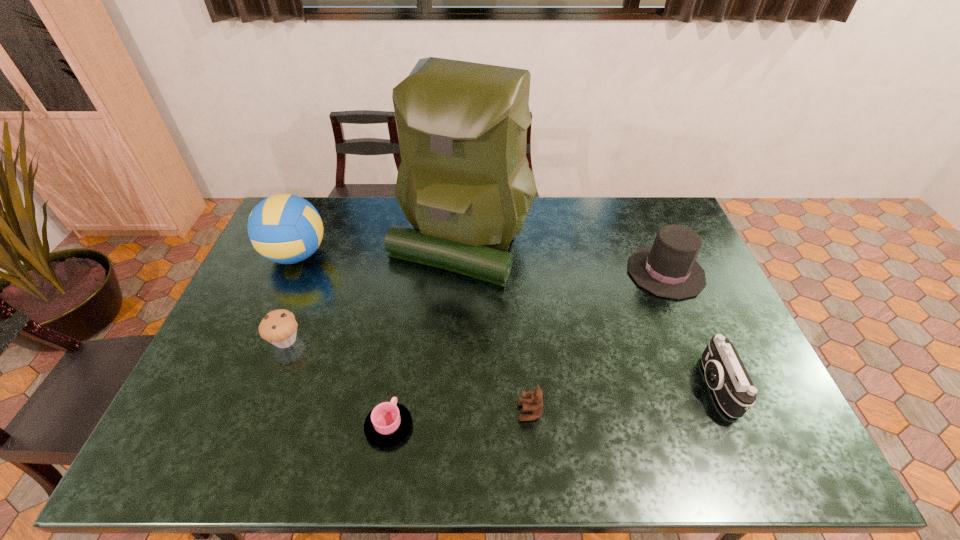
Where is `free space located 0.330m on the front of the fifth shortest object with the decoration`? Image resolution: width=960 pixels, height=540 pixels. free space located 0.330m on the front of the fifth shortest object with the decoration is located at coordinates (525, 272).

You are a GUI agent. You are given a task and a screenshot of the screen. Output one action in this format:
    pyautogui.click(x=<x>, y=<y>)
    Task: Click on the free space located on the front of the fifth shortest object with the decoration
    This screenshot has height=540, width=960.
    Given the screenshot: What is the action you would take?
    pyautogui.click(x=612, y=272)

Locate an element on the screen. free space located on the front lens of the camera is located at coordinates (544, 386).

Where is `vacant area situated 0.050m on the front lens of the camera`? This screenshot has width=960, height=540. vacant area situated 0.050m on the front lens of the camera is located at coordinates (681, 386).

This screenshot has height=540, width=960. Identify the location of free point located on the front lens of the camera. (567, 386).

Where is `vacant space located on the back of the muffin`? This screenshot has width=960, height=540. vacant space located on the back of the muffin is located at coordinates (316, 262).

The width and height of the screenshot is (960, 540). Find the location of `free region located on the face of the teddy bear`. free region located on the face of the teddy bear is located at coordinates (462, 411).

You are a GUI agent. You are given a task and a screenshot of the screen. Output one action in this format:
    pyautogui.click(x=<x>, y=<y>)
    Task: Click on the vacant space located 0.300m on the face of the teddy bear
    Image resolution: width=960 pixels, height=540 pixels.
    Given the screenshot: What is the action you would take?
    pyautogui.click(x=396, y=411)

Identify the location of blank area located 0.090m on the face of the teddy bear. (482, 411).

This screenshot has height=540, width=960. I want to click on free space located on the side with the handle of the shortest object, so click(407, 310).